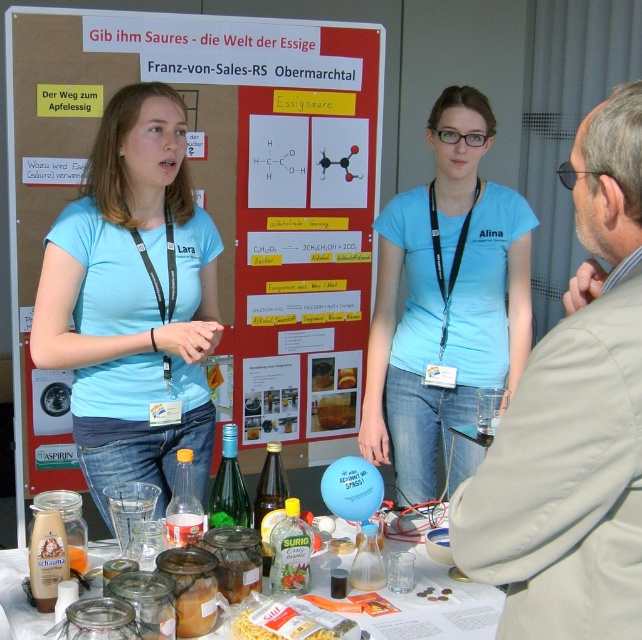
Question: Does light blue t-shirt at center come in front of translucent plastic bottle at center?

Choices:
 (A) yes
 (B) no

Answer: (B)

Question: Is white matte pasta at center thinner than translucent plastic bottle at lower center?

Choices:
 (A) yes
 (B) no

Answer: (B)

Question: Which of the following is the farthest from the observer?

Choices:
 (A) (282, 598)
 (B) (288, 586)
 (C) (257, 26)

Answer: (C)

Question: Does beige fabric coat at upper right appear on the right side of white matte pasta at center?

Choices:
 (A) no
 (B) yes

Answer: (B)

Question: Among these points, which one is farthest from the camera?

Choices:
 (A) (266, 532)
 (B) (621, 493)
 (C) (279, 403)
 (D) (211, 234)

Answer: (C)

Question: Which object appears farthest from the camera in this image?

Choices:
 (A) translucent glass jars at lower center
 (B) red cardboard poster at center
 (C) translucent glass bottle at center

Answer: (B)